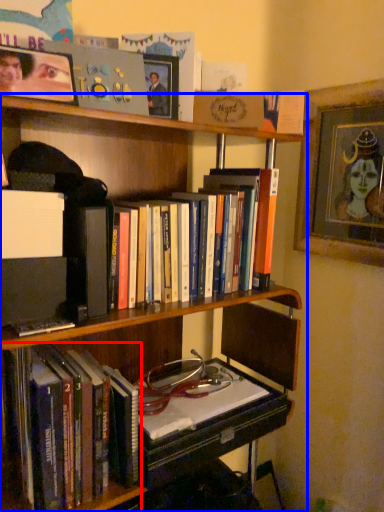
Question: Which point is further to the camera, book (highlighted by a red box) or bookcase (highlighted by a blue box)?

Choices:
 (A) book
 (B) bookcase

Answer: (A)